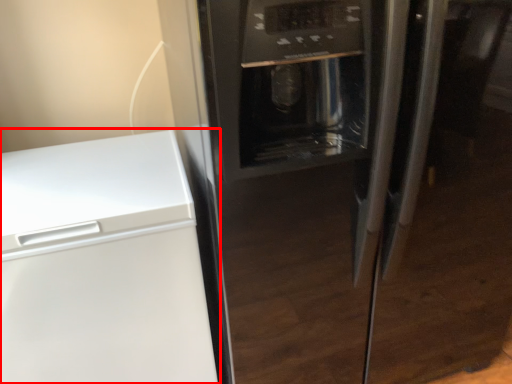
Question: In this image, where is home appliance (annotated by the red box) located relative to refrigerator?

Choices:
 (A) left
 (B) right

Answer: (A)